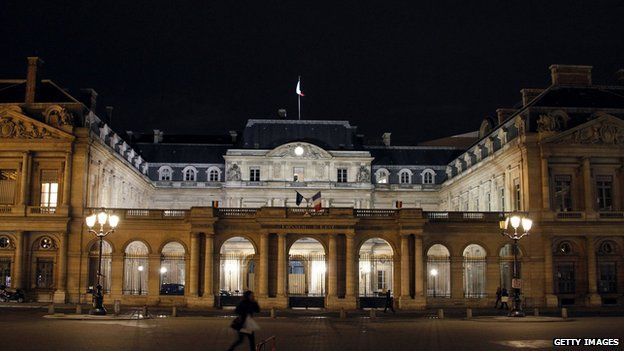
Locate an element on the screen. This screenshot has height=351, width=624. entrance is located at coordinates (303, 242).